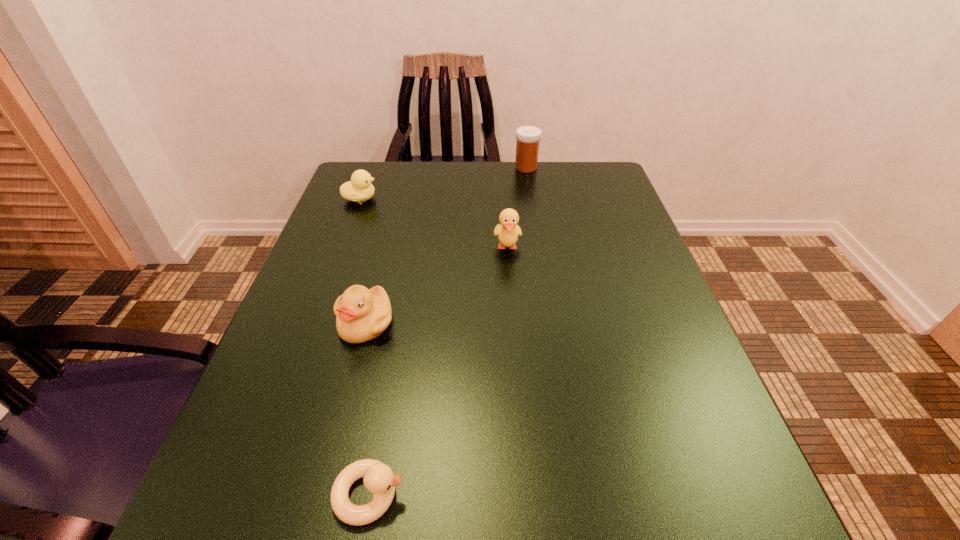
You are a GUI agent. You are given a task and a screenshot of the screen. Output one action in this format:
    pyautogui.click(x=<x>, y=<y>)
    Task: Click on the medicine
    
    Given the screenshot: What is the action you would take?
    pyautogui.click(x=527, y=146)

What are the coordinates of `the farthest object` in the screenshot? It's located at (527, 146).

Locate an element on the screen. This screenshot has width=960, height=540. the third nearest object is located at coordinates (507, 231).

At what (x,y) coordinates should I click in order to perform the action: click on the second farthest duckling. Please return your answer as a coordinate pair (x, y). Looking at the image, I should click on (507, 231).

You are a GUI agent. You are given a task and a screenshot of the screen. Output one action in this format:
    pyautogui.click(x=<x>, y=<y>)
    Task: Click on the second nearest object
    The width and height of the screenshot is (960, 540).
    Given the screenshot: What is the action you would take?
    pyautogui.click(x=362, y=314)

This screenshot has height=540, width=960. Find the location of `the fourth nearest object`. the fourth nearest object is located at coordinates (359, 189).

Identify the location of the second shortest object. This screenshot has width=960, height=540. (359, 189).

Image resolution: width=960 pixels, height=540 pixels. In order to click on the shortest duckling in this screenshot , I will do `click(379, 479)`.

Find the location of a particular element. the nearest object is located at coordinates (379, 479).

Where is `free space located on the left of the farthest object`? This screenshot has height=540, width=960. free space located on the left of the farthest object is located at coordinates (445, 167).